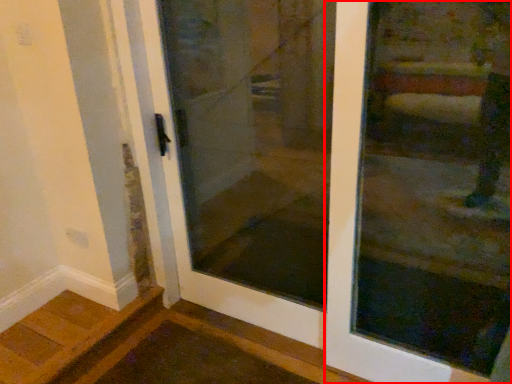
Question: From the image's perspective, where is door (annotated by the red box) located relative to elevator door?

Choices:
 (A) above
 (B) below

Answer: (B)